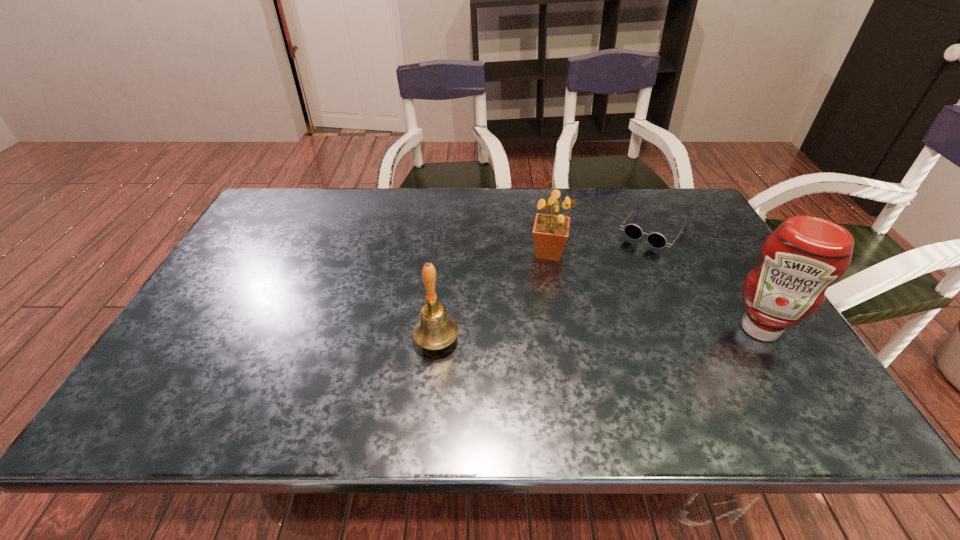
Identify the location of bell. This screenshot has width=960, height=540. 435,330.

At what (x,y) coordinates should I click in order to perform the action: click on the tallest object. Please return your answer as a coordinate pair (x, y). Looking at the image, I should click on (799, 260).

Where is `the second object from left to right`? The width and height of the screenshot is (960, 540). the second object from left to right is located at coordinates (550, 233).

Where is `the shortest object`? This screenshot has width=960, height=540. the shortest object is located at coordinates (657, 240).

Find the location of `free space located on the left of the leftmost object`. free space located on the left of the leftmost object is located at coordinates (342, 340).

Where is `vacant space located 0.320m on the back of the tallest object`? This screenshot has height=540, width=960. vacant space located 0.320m on the back of the tallest object is located at coordinates (701, 235).

Find the location of a particular element. The height and width of the screenshot is (540, 960). free space located at the front of the third object from right to left with flowers visible is located at coordinates (591, 286).

This screenshot has height=540, width=960. Identify the location of free region located at the front of the third object from right to left with flowers visible. (599, 293).

Where is `free region located 0.330m at the front of the third object from right to left with flowers visible`? free region located 0.330m at the front of the third object from right to left with flowers visible is located at coordinates (657, 340).

Identify the location of vacant space situated 0.220m on the front-facing side of the sunglasses. The image size is (960, 540). (606, 291).